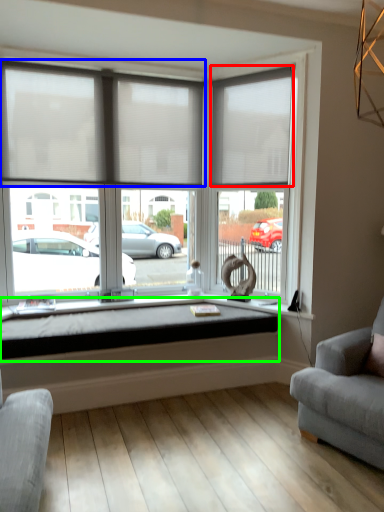
Question: Estimate the real-world distances between objects in this image. Which object is closer to window blind (highlighted by a red box), window blind (highlighted by a blue box) or window sill (highlighted by a green box)?

Choices:
 (A) window blind
 (B) window sill

Answer: (A)